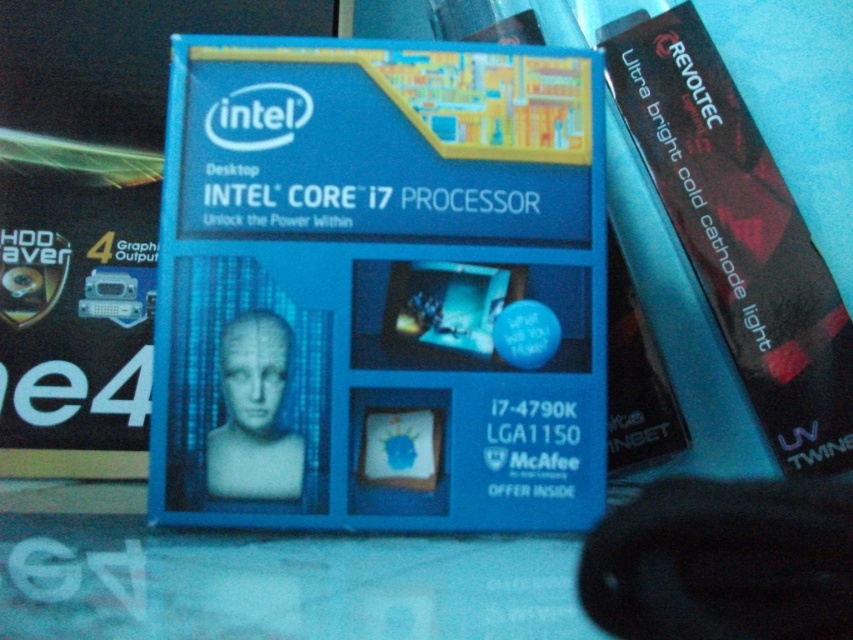
From the picture: You are designing a display stand for the blue cardboard box at center and need to place a black plastic revoltec light at upper right to highlight it. The minimum distance required between the box and the light for optimal lighting is 10 inches. Based on the scene, will the current placement meet this requirement?

The blue cardboard box at center is 10.44 inches from the black plastic revoltec light at upper right, which exceeds the minimum required distance of 10 inches. Therefore, the current placement meets the requirement for optimal lighting.

You are holding a blue cardboard box at center and looking towards the black plastic revoltec light at upper right. Which object is nearer to you?

The blue cardboard box at center is closer to you than the black plastic revoltec light at upper right.

In the scene shown: What is the 2D coordinate of the blue cardboard box at center in the image?

The blue cardboard box at center is located at the 2D coordinate point of [380,288].